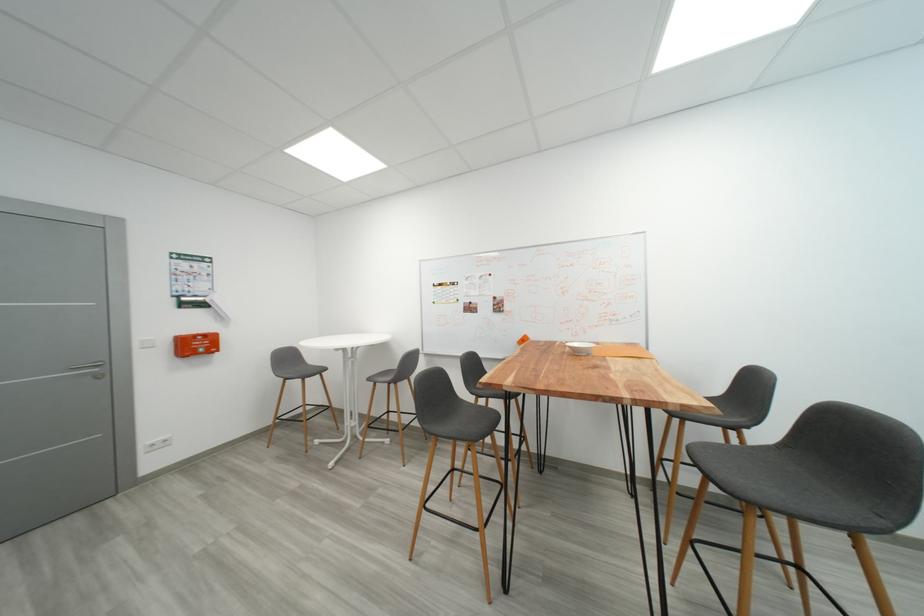
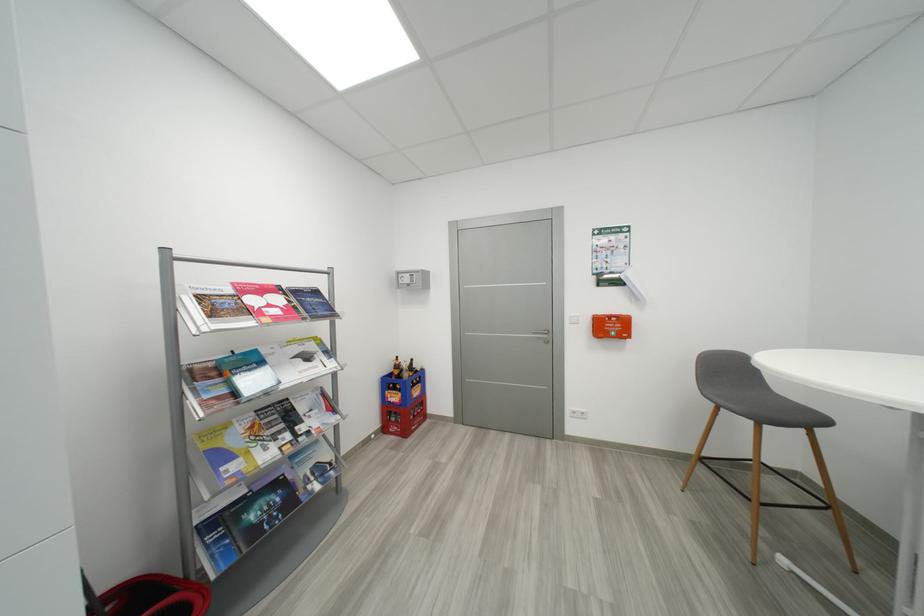
The point at [203,347] is marked in the first image. Where is the corresponding point in the second image?

(617, 330)